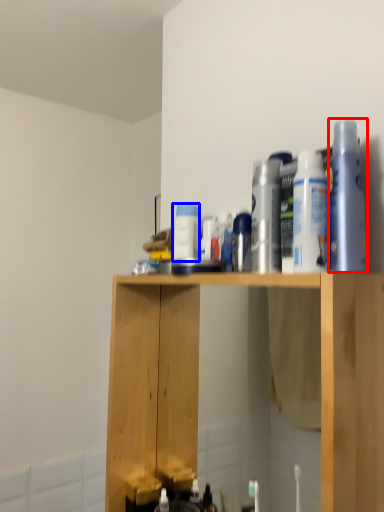
Question: Among these objects, which one is farthest to the camera, cleaning product (highlighted by a red box) or cleaning product (highlighted by a blue box)?

Choices:
 (A) cleaning product
 (B) cleaning product

Answer: (B)